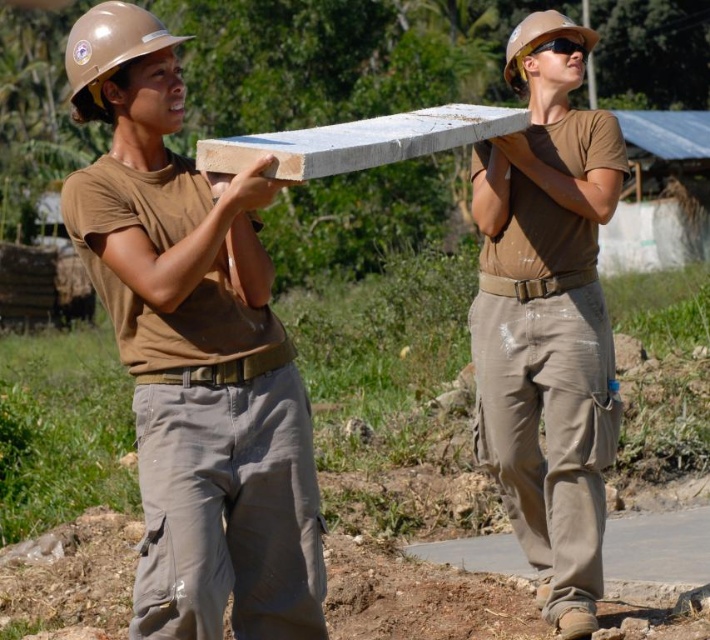
Question: Considering the real-world distances, which object is farthest from the matte brown hard hat at upper center?

Choices:
 (A) matte concrete block at upper center
 (B) matte brown hard hat at upper left
 (C) matte concrete plank at center

Answer: (B)

Question: Which point is farther to the camera?

Choices:
 (A) (111, 42)
 (B) (151, 531)
 (C) (518, 58)

Answer: (C)

Question: From the image, what is the correct spatial relationship of matte brown hard hat at upper left in relation to matte brown hard hat at upper center?

Choices:
 (A) right
 (B) left

Answer: (B)

Question: Considering the relative positions of matte concrete block at upper center and matte concrete plank at center in the image provided, where is matte concrete block at upper center located with respect to matte concrete plank at center?

Choices:
 (A) left
 (B) right

Answer: (A)

Question: Estimate the real-world distances between objects in this image. Which object is closer to the matte concrete plank at center?

Choices:
 (A) matte concrete block at upper center
 (B) matte brown hard hat at upper center

Answer: (B)

Question: Can you confirm if matte concrete block at upper center is bigger than matte brown hard hat at upper center?

Choices:
 (A) no
 (B) yes

Answer: (A)